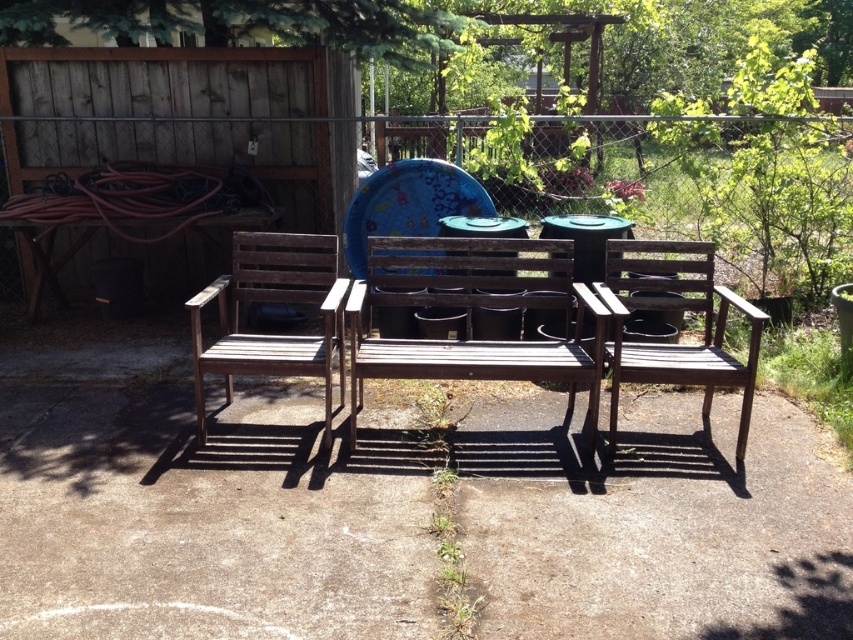
Is wooden bench at center to the right of dark brown wood chair at center from the viewer's perspective?

In fact, wooden bench at center is to the left of dark brown wood chair at center.

Is the position of wooden bench at center less distant than that of dark brown wood chair at center?

No, it is behind dark brown wood chair at center.

Is point (556, 364) in front of point (665, 296)?

Yes.

Where is `wooden bench at center`? The height and width of the screenshot is (640, 853). wooden bench at center is located at coordinates [471, 316].

Does wooden bench at center appear over wooden chair at left?

Correct, wooden bench at center is located above wooden chair at left.

Who is positioned more to the right, wooden bench at center or wooden chair at left?

wooden bench at center is more to the right.

The image size is (853, 640). Identify the location of wooden bench at center. (471, 316).

Which is below, wooden chair at left or dark brown wood chair at center?

wooden chair at left is below.

Can you confirm if wooden chair at left is shorter than dark brown wood chair at center?

Indeed, wooden chair at left has a lesser height compared to dark brown wood chair at center.

Locate an element on the screen. wooden chair at left is located at coordinates (273, 301).